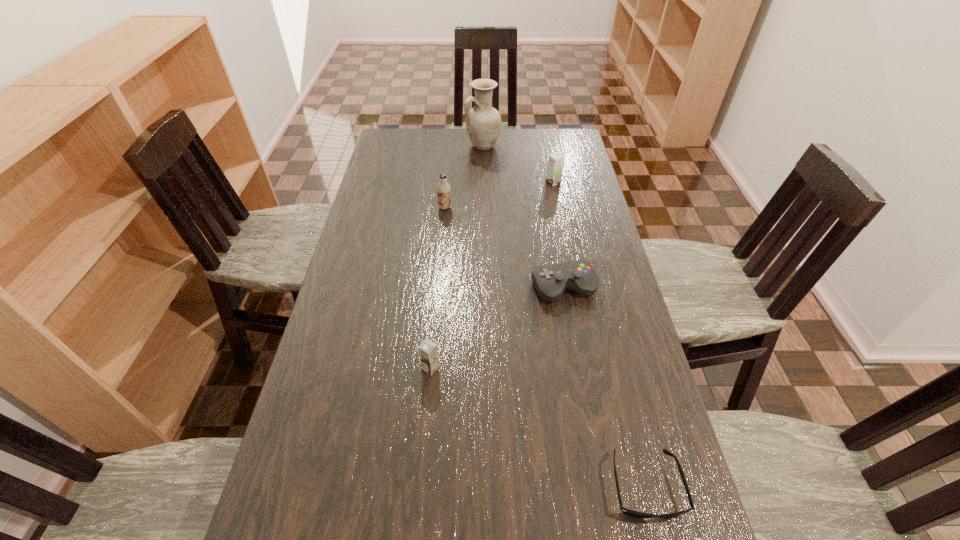
Find the location of a particular element. This screenshot has width=960, height=540. the farthest object is located at coordinates (483, 122).

Find the location of a particular element. This screenshot has width=960, height=540. pottery is located at coordinates (483, 122).

The image size is (960, 540). I want to click on the second farthest chocolate milk, so click(x=443, y=188).

The image size is (960, 540). In order to click on the farthest chocolate milk in this screenshot , I will do `click(556, 160)`.

Identify the location of the fifth nearest object. The image size is (960, 540). (556, 160).

Where is `the fourth tallest object`? This screenshot has width=960, height=540. the fourth tallest object is located at coordinates (428, 352).

I want to click on the fifth farthest object, so click(428, 352).

Locate an element on the screen. This screenshot has height=540, width=960. the second shortest object is located at coordinates (550, 281).

Locate an element on the screen. the fourth farthest object is located at coordinates (550, 281).

You are a GUI agent. You are given a task and a screenshot of the screen. Output one action in this format:
    pyautogui.click(x=<x>, y=<y>)
    Task: Click on the shortest object
    
    Given the screenshot: What is the action you would take?
    pyautogui.click(x=625, y=511)